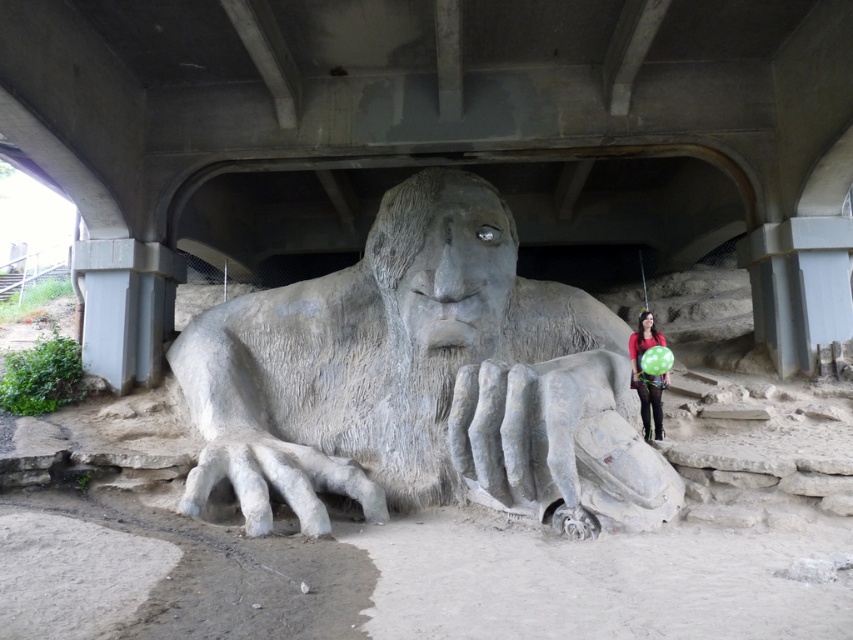
Which is behind, point (135, 170) or point (650, 397)?

Positioned behind is point (135, 170).

Is concrete at center smaller than matte black dress at lower right?

Incorrect, concrete at center is not smaller in size than matte black dress at lower right.

Is point (341, 193) positioned in front of point (651, 404)?

No, it is behind (651, 404).

Where is `concrete at center`? The image size is (853, 640). concrete at center is located at coordinates (438, 141).

Who is positioned more to the right, concrete at center or stone statue at center?

stone statue at center is more to the right.

Is concrete at center further to the viewer compared to stone statue at center?

Yes, it is behind stone statue at center.

This screenshot has height=640, width=853. Find the location of `concrete at center`. concrete at center is located at coordinates (438, 141).

Find the location of a particular element. concrete at center is located at coordinates (438, 141).

Measure the distance between stone statue at center and camera.

A distance of 9.41 feet exists between stone statue at center and camera.

Does point (515, 452) lie in front of point (643, 385)?

Yes, it is.

The height and width of the screenshot is (640, 853). Identify the location of stone statue at center. (421, 380).